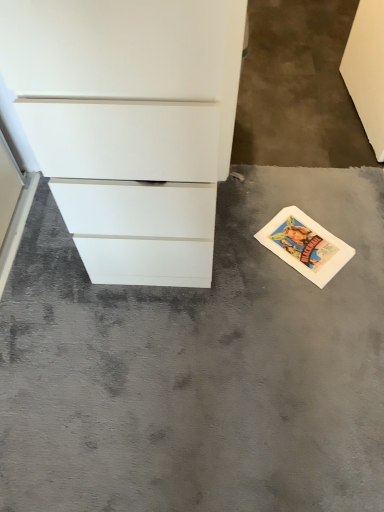
Find the location of a particular element. The image size is (384, 512). free point in front of white paper postcard at lower right is located at coordinates (314, 303).